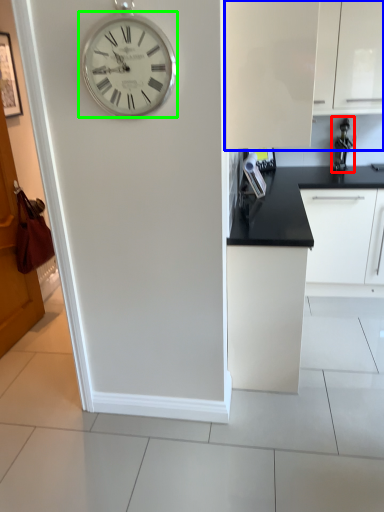
Question: Which object is the farthest from appliance (highlighted by a red box)? Choose among these: cabinetry (highlighted by a blue box) or wall clock (highlighted by a green box).

Choices:
 (A) cabinetry
 (B) wall clock

Answer: (B)